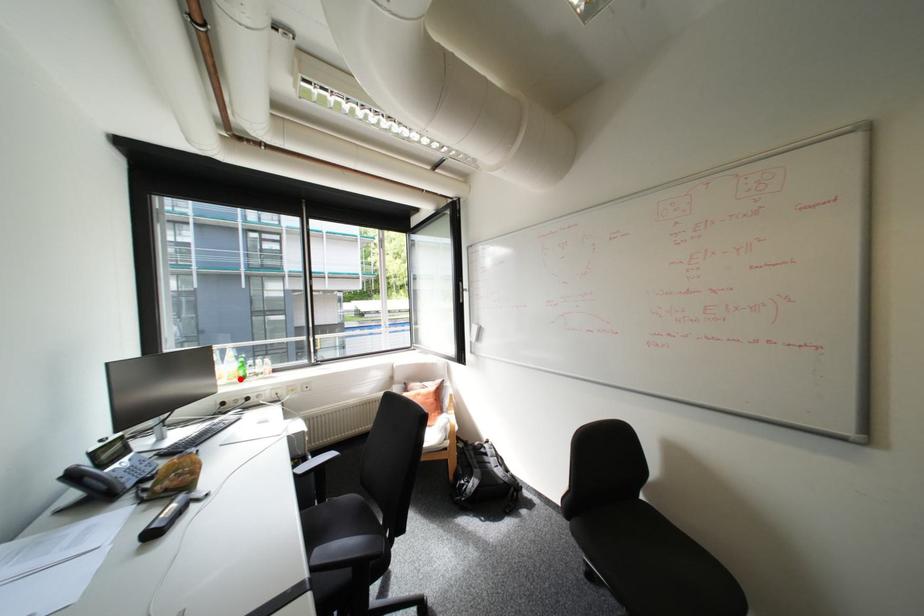
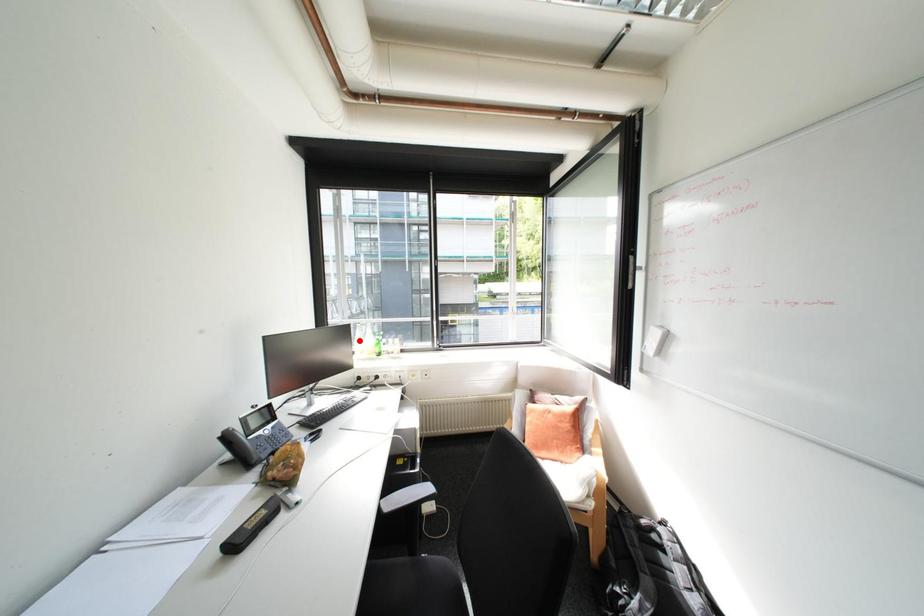
I am providing you with two images of the same scene from different viewpoints. A red point is marked on the first image and another point is marked on the second image. Are the points marked in image1 and image2 representing the same 3D position?

No